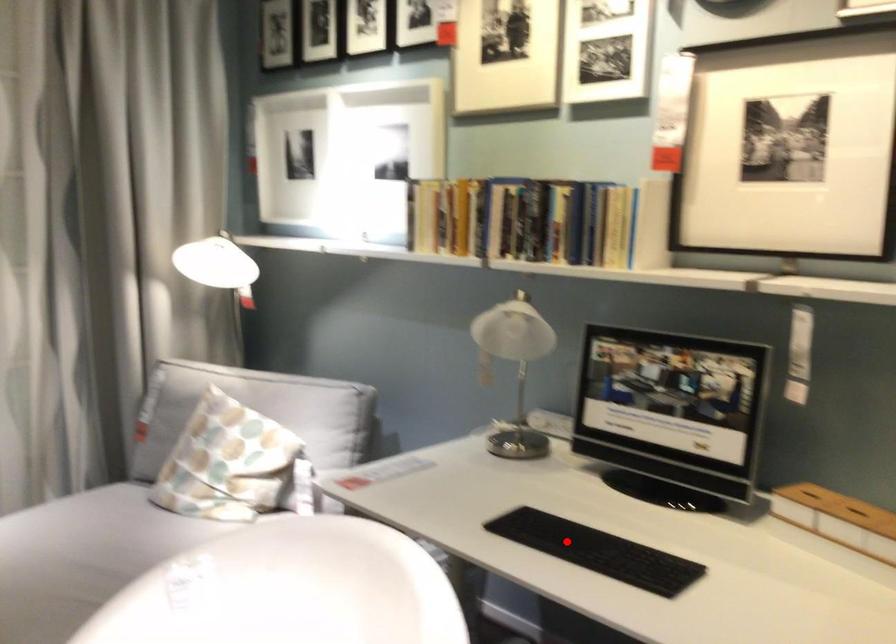
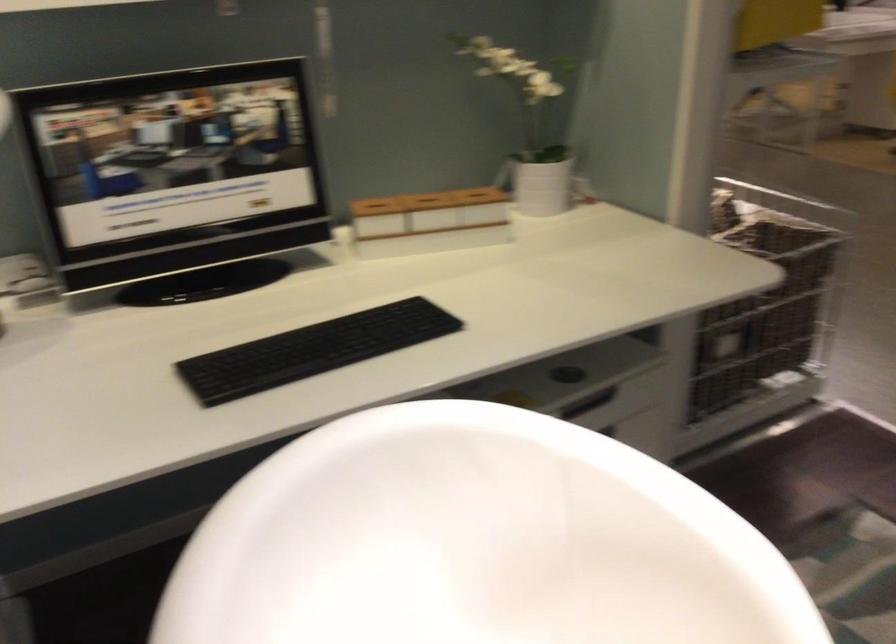
Locate, in the second image, the point that corresponds to the highlighted location in the first image.

(313, 350)